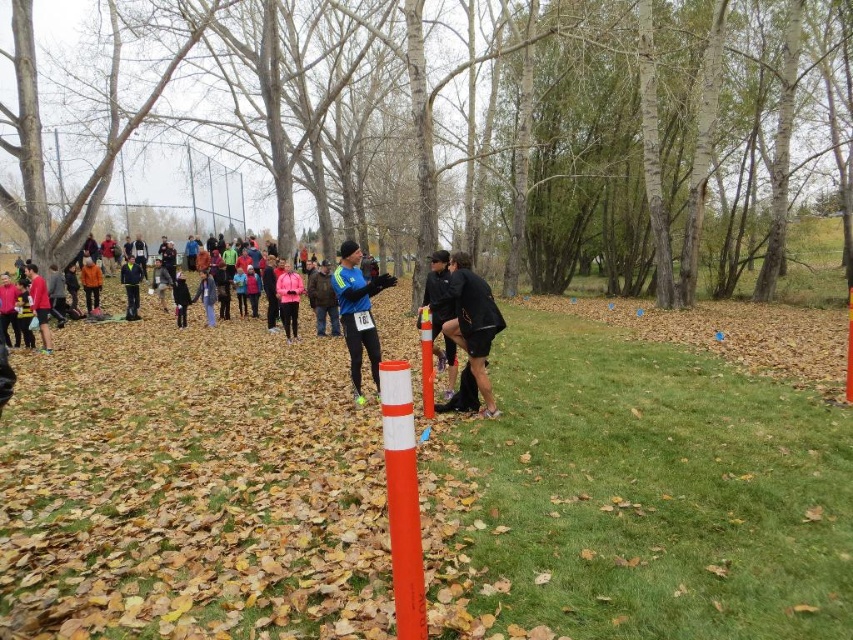
Does orange matte pole at center lie behind black matte shorts at center?

That is False.

Who is more distant from viewer, (412, 465) or (480, 321)?

The point (480, 321) is more distant.

Describe the element at coordinates (402, 499) in the screenshot. Image resolution: width=853 pixels, height=640 pixels. I see `orange matte pole at center` at that location.

The width and height of the screenshot is (853, 640). Find the location of `orange matte pole at center`. orange matte pole at center is located at coordinates [x=402, y=499].

This screenshot has height=640, width=853. In order to click on black matte shorts at center in this screenshot , I will do `click(471, 336)`.

How far apart are black matte shorts at center and matte pink jacket at center?

6.43 meters

You are a GUI agent. You are given a task and a screenshot of the screen. Output one action in this format:
    pyautogui.click(x=<x>, y=<y>)
    Task: Click on the black matte shorts at center
    The image size is (853, 640).
    Given the screenshot: What is the action you would take?
    pyautogui.click(x=471, y=336)

The width and height of the screenshot is (853, 640). Describe the element at coordinates (471, 336) in the screenshot. I see `black matte shorts at center` at that location.

Does black matte shorts at center have a smaller size compared to blue synthetic jacket at center?

No.

Does point (480, 348) come in front of point (349, 312)?

Yes, it is in front of point (349, 312).

This screenshot has width=853, height=640. What are the coordinates of `black matte shorts at center` in the screenshot? It's located at pyautogui.click(x=471, y=336).